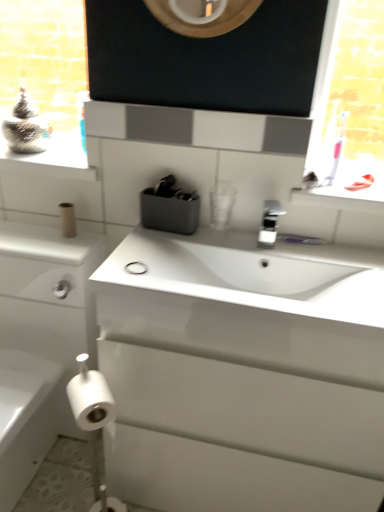
Question: Is point (344, 287) closer or farther from the camera than point (264, 234)?

Choices:
 (A) closer
 (B) farther

Answer: (A)

Question: Considering the positions of white glossy sink at center and silver metallic faucet at center in the image, is white glossy sink at center taller or shorter than silver metallic faucet at center?

Choices:
 (A) tall
 (B) short

Answer: (A)

Question: Considering the real-world distances, which object is closest to the white glossy cabinet at left?

Choices:
 (A) silver metallic faucet at center
 (B) white matte toilet paper at lower left, acting as the third toilet paper starting from the top
 (C) white glossy sink at center
 (D) metallic silver container at upper left
 (E) brown cardboard toilet paper at lower left, the 3th toilet paper ordered from the bottom

Answer: (E)

Question: Which of these objects is positioned closest to the white glossy window sill at upper right?

Choices:
 (A) white matte toilet paper at lower left, the first toilet paper positioned from the bottom
 (B) white glossy sink at center
 (C) silver metallic faucet at center
 (D) white matte toilet paper at lower left, acting as the 2th toilet paper starting from the bottom
 (E) white glossy sink at center

Answer: (C)